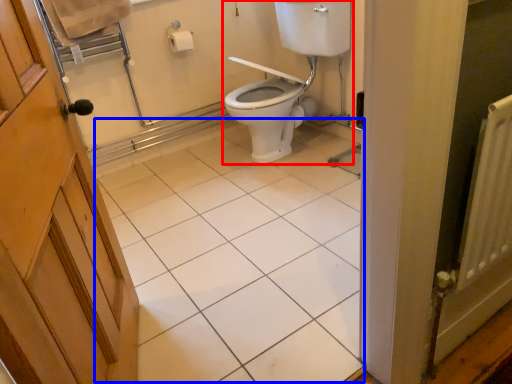
Question: Among these objects, which one is nearest to the camera, sink (highlighted by a red box) or tile (highlighted by a blue box)?

Choices:
 (A) sink
 (B) tile

Answer: (B)